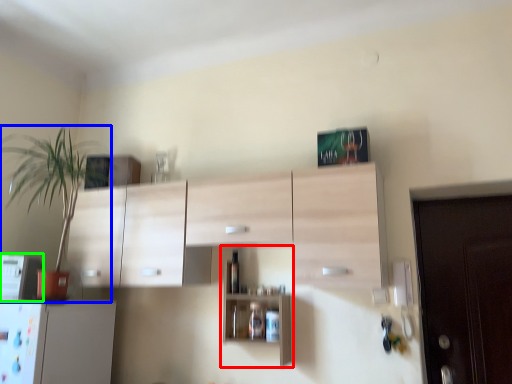
Question: Which is nearer to the shelf (highlighted by a red box)? houseplant (highlighted by a blue box) or appliance (highlighted by a green box).

Choices:
 (A) houseplant
 (B) appliance

Answer: (B)